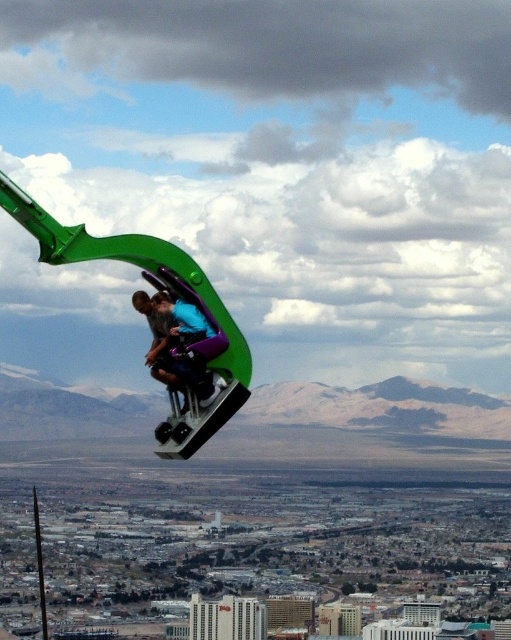
The height and width of the screenshot is (640, 511). Describe the element at coordinates (156, 289) in the screenshot. I see `green matte parachute at center` at that location.

Between green matte parachute at center and blue fabric person at center, which one appears on the right side from the viewer's perspective?

blue fabric person at center

You are a GUI agent. You are given a task and a screenshot of the screen. Output one action in this format:
    pyautogui.click(x=<x>, y=<y>)
    Task: Click on the green matte parachute at center
    This screenshot has width=511, height=640.
    Given the screenshot: What is the action you would take?
    pyautogui.click(x=156, y=289)

Where is `green matte parachute at center`? The image size is (511, 640). green matte parachute at center is located at coordinates tap(156, 289).